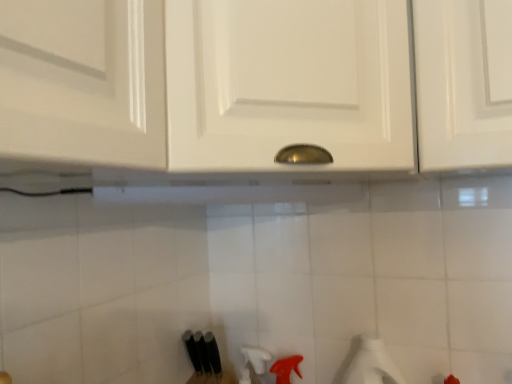
What do you see at coordinates (340, 80) in the screenshot? I see `white glossy cabinet at center` at bounding box center [340, 80].

The image size is (512, 384). Identify the location of white glossy cabinet at center. (340, 80).

At what (x,y) coordinates should I click in order to perform the action: click on white glossy cabinet at center. Please return your answer as a coordinate pair (x, y). This screenshot has height=384, width=512. Looking at the image, I should click on (340, 80).